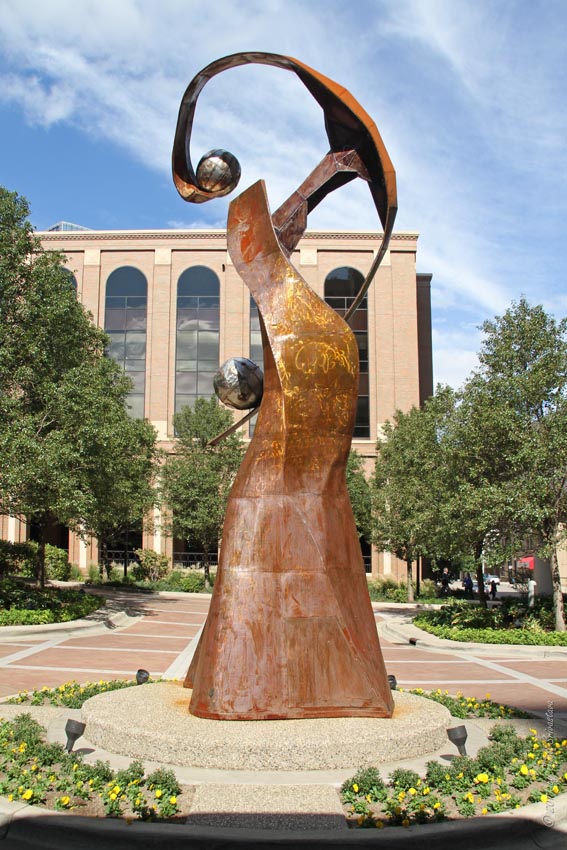
Locate an element on the screen. window is located at coordinates (204, 304).